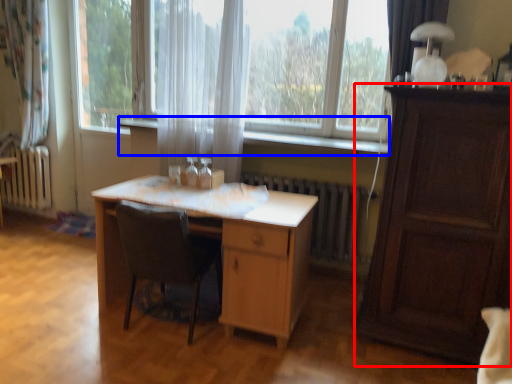
Question: Which point is closer to the camera, cabinetry (highlighted by a red box) or window sill (highlighted by a blue box)?

Choices:
 (A) cabinetry
 (B) window sill

Answer: (A)